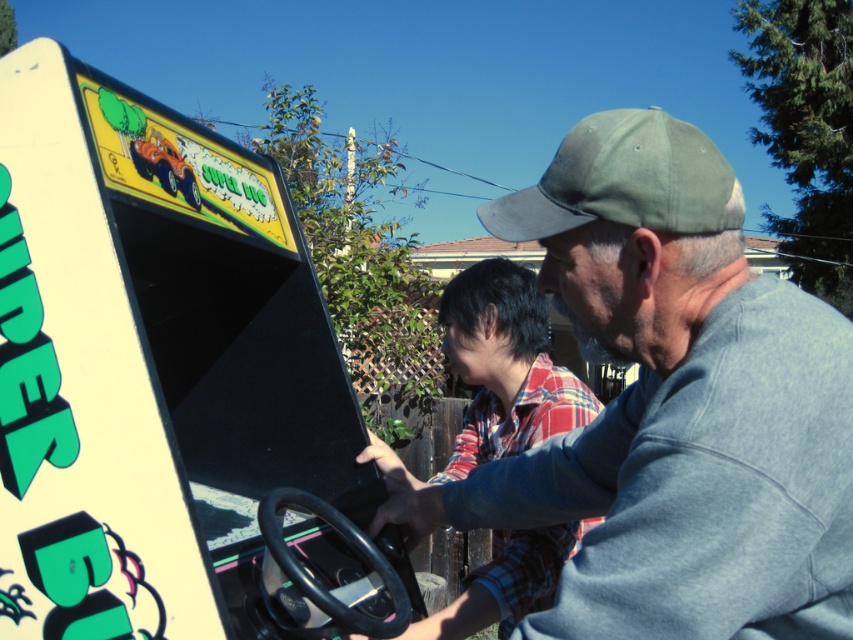
Question: Which point is farther from the camera taking this photo?

Choices:
 (A) (625, 612)
 (B) (633, 154)

Answer: (B)

Question: Among these objects, which one is farthest from the camera?

Choices:
 (A) green fabric baseball cap at upper center
 (B) gray cotton shirt at center

Answer: (A)

Question: Among these objects, which one is farthest from the camera?

Choices:
 (A) green fabric baseball cap at upper center
 (B) gray cotton shirt at center

Answer: (A)

Question: Observing the image, what is the correct spatial positioning of gray cotton shirt at center in reference to green fabric baseball cap at upper center?

Choices:
 (A) above
 (B) below

Answer: (B)

Question: Can you confirm if gray cotton shirt at center is bigger than green fabric baseball cap at upper center?

Choices:
 (A) yes
 (B) no

Answer: (A)

Question: Does gray cotton shirt at center lie behind green fabric baseball cap at upper center?

Choices:
 (A) no
 (B) yes

Answer: (A)